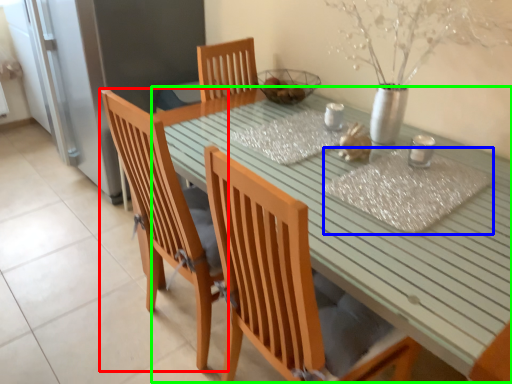
Question: Considering the real-world distances, which object is closest to chair (highlighted by a red box)? place mat (highlighted by a blue box) or table (highlighted by a green box).

Choices:
 (A) place mat
 (B) table

Answer: (B)